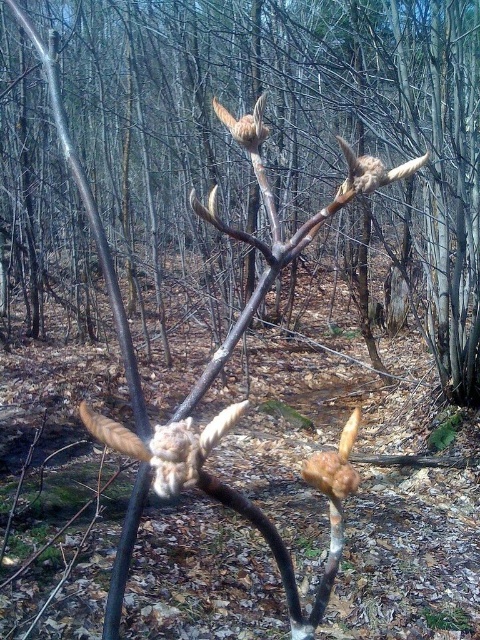
You are standing in the forest looking at the antlered structure. There are two points marked in the image. The first point is at coordinates point (408, 164) and the second is at point (255, 109). Which of these points is nearer to you?

Point (408, 164) is closer to the camera than point (255, 109). Therefore, the first point is nearer to you.

You are an ornithologist observing the forest scene. You notice the brown fuzzy branch at upper center and the brown fuzzy bird at upper center. Which object is positioned higher in the image?

The brown fuzzy branch at upper center is taller than the brown fuzzy bird at upper center, so the branch is positioned higher.